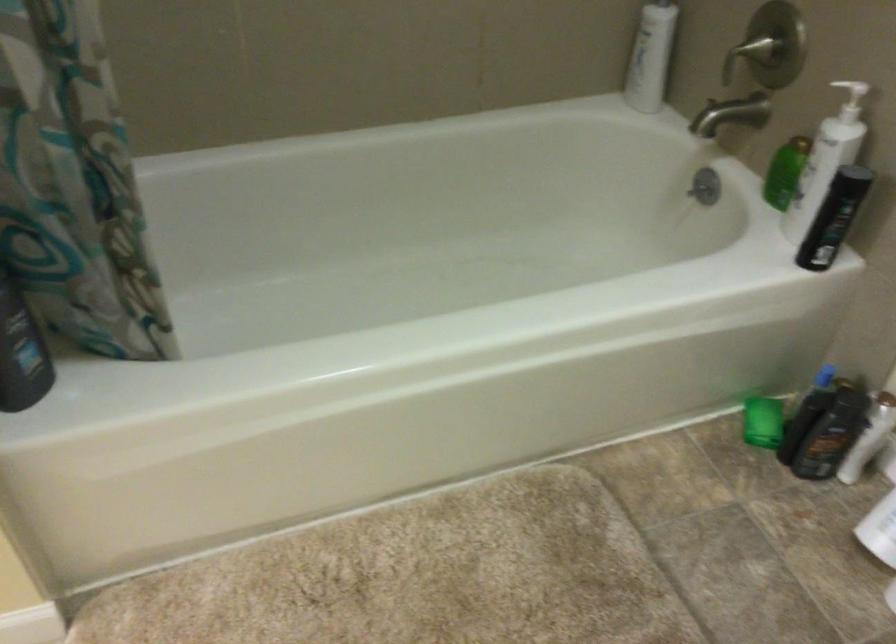
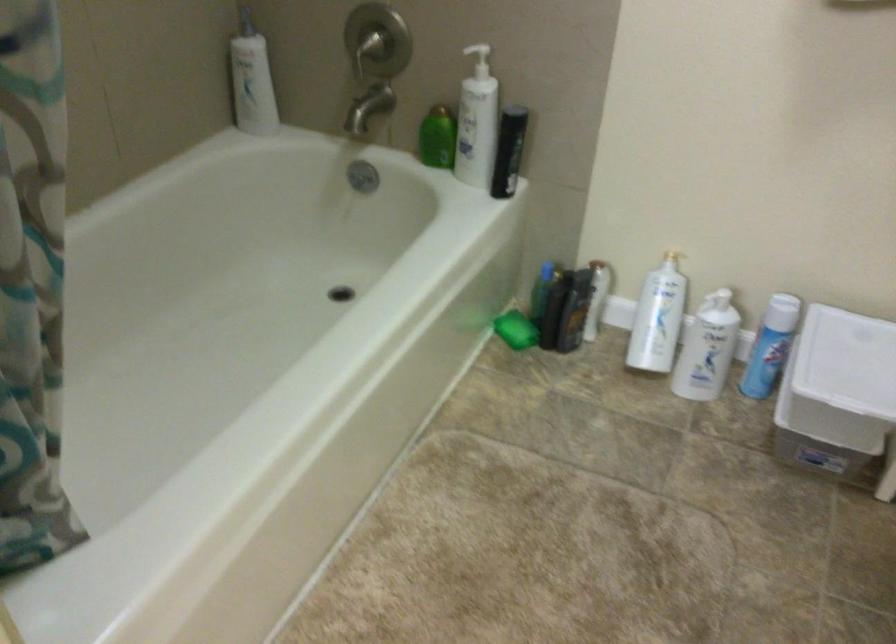
The point at (757, 419) is marked in the first image. Where is the corresponding point in the second image?

(515, 328)